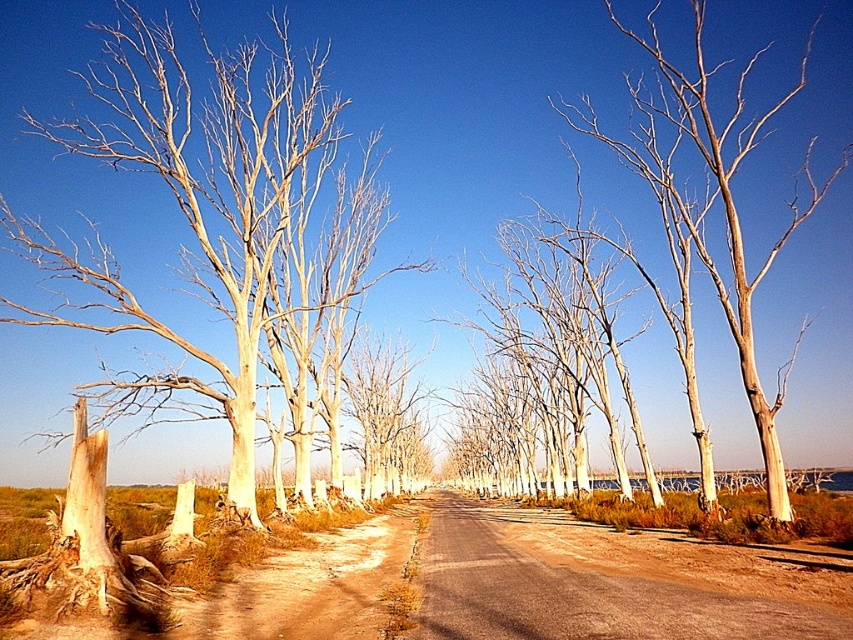
Question: Estimate the real-world distances between objects in this image. Which object is closer to the brown dirt track at center?

Choices:
 (A) light brown bark tree at left
 (B) smooth bark tree at center

Answer: (A)

Question: Can you confirm if brown dirt track at center is positioned above smooth bark tree at center?

Choices:
 (A) no
 (B) yes

Answer: (A)

Question: Which object is positioned closest to the smooth bark tree at center?

Choices:
 (A) light brown bark tree at left
 (B) brown dirt track at center

Answer: (A)

Question: Where is light brown bark tree at left located in relation to smooth bark tree at center in the image?

Choices:
 (A) above
 (B) below

Answer: (B)

Question: Does light brown bark tree at left appear over smooth bark tree at center?

Choices:
 (A) yes
 (B) no

Answer: (B)

Question: Which object is positioned closest to the brown dirt track at center?

Choices:
 (A) smooth bark tree at center
 (B) light brown bark tree at left

Answer: (B)